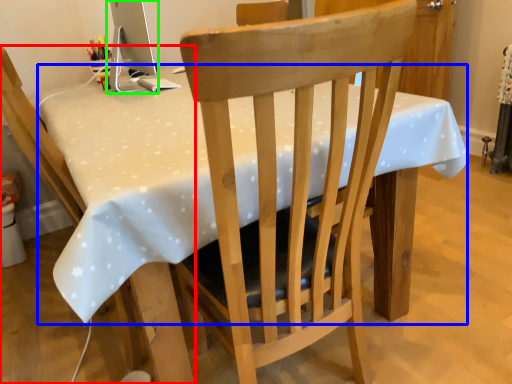
Question: Which object is the farthest from chair (highlighted by a red box)? Choose among these: table (highlighted by a blue box) or computer monitor (highlighted by a green box).

Choices:
 (A) table
 (B) computer monitor

Answer: (B)